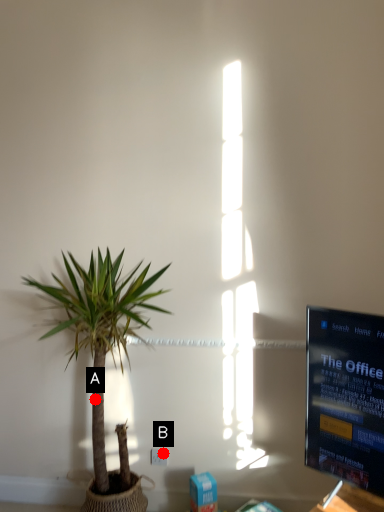
Question: Two points are circled on the image, labeled by A and B beside each circle. Which of the following is the farthest from the observer?

Choices:
 (A) A is further
 (B) B is further

Answer: (A)